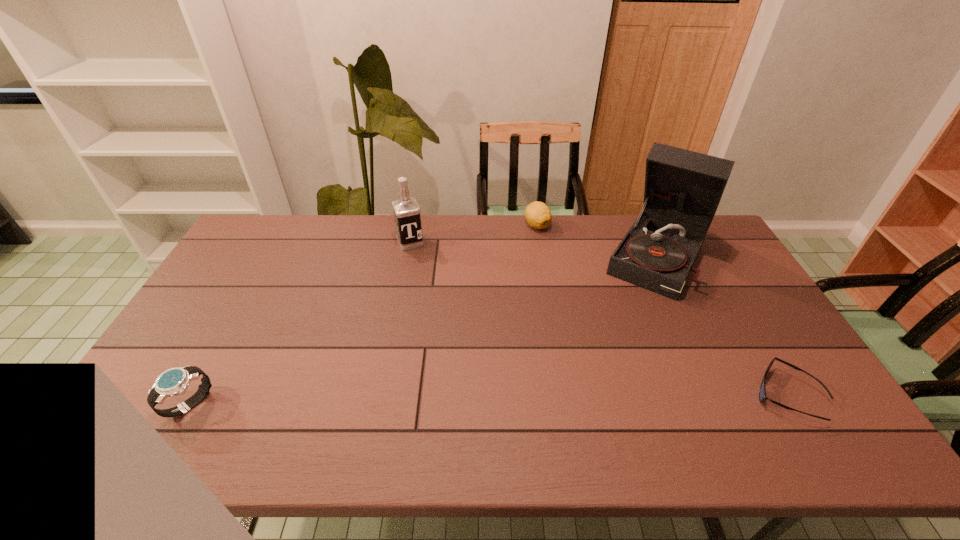
Where is `vacant area that lies between the tallest object and the third tallest object`? vacant area that lies between the tallest object and the third tallest object is located at coordinates (424, 330).

Where is `empty location between the tallest object and the watch`? empty location between the tallest object and the watch is located at coordinates pos(424,330).

Find the location of a particular element. The height and width of the screenshot is (540, 960). free space that is in between the vodka and the phonograph_record is located at coordinates click(x=535, y=249).

Find the location of `free space that is in between the phonograph_record and the sunglasses`. free space that is in between the phonograph_record and the sunglasses is located at coordinates (722, 325).

Locate an element on the screen. The width and height of the screenshot is (960, 540). vacant area that lies between the shortest object and the second object from left to right is located at coordinates (599, 319).

Where is `object that stands as the closest to the shortest object`? This screenshot has height=540, width=960. object that stands as the closest to the shortest object is located at coordinates (683, 188).

This screenshot has width=960, height=540. In order to click on object that is the closest to the vodka in this screenshot , I will do `click(538, 215)`.

Where is `free region that satisfies the following two spatial constraints: 1. on the front side of the third object from left to right; 2. at the front of the shortest object showing the lenses`? The width and height of the screenshot is (960, 540). free region that satisfies the following two spatial constraints: 1. on the front side of the third object from left to right; 2. at the front of the shortest object showing the lenses is located at coordinates click(x=565, y=395).

Find the location of `free space that satisfies the following two spatial constraints: 1. on the front side of the second tallest object; 2. at the front of the shortest object showing the lenses`. free space that satisfies the following two spatial constraints: 1. on the front side of the second tallest object; 2. at the front of the shortest object showing the lenses is located at coordinates (381, 395).

Locate an element on the screen. The width and height of the screenshot is (960, 540). vacant point that satisfies the following two spatial constraints: 1. on the front side of the shortest object; 2. at the front of the lemon showing the lenses is located at coordinates (565, 395).